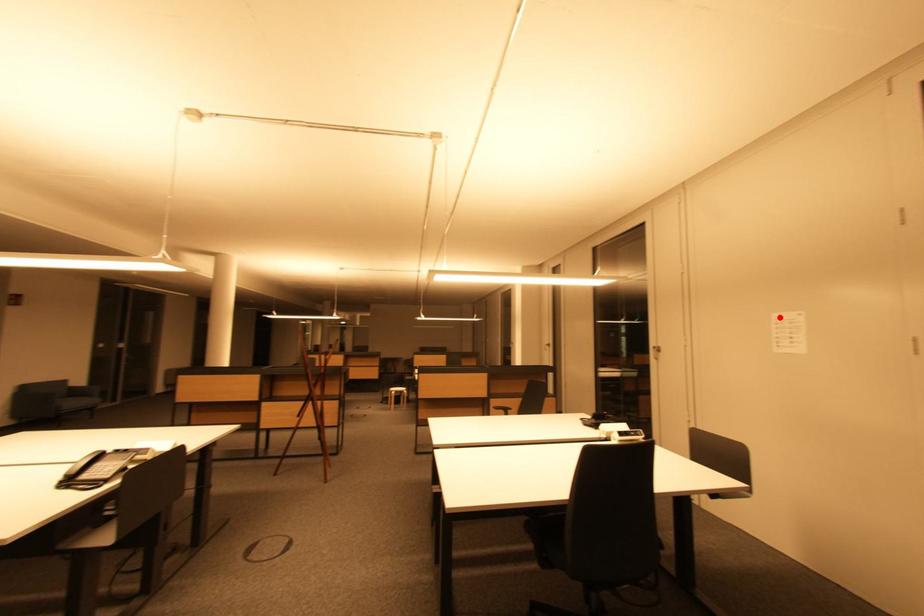
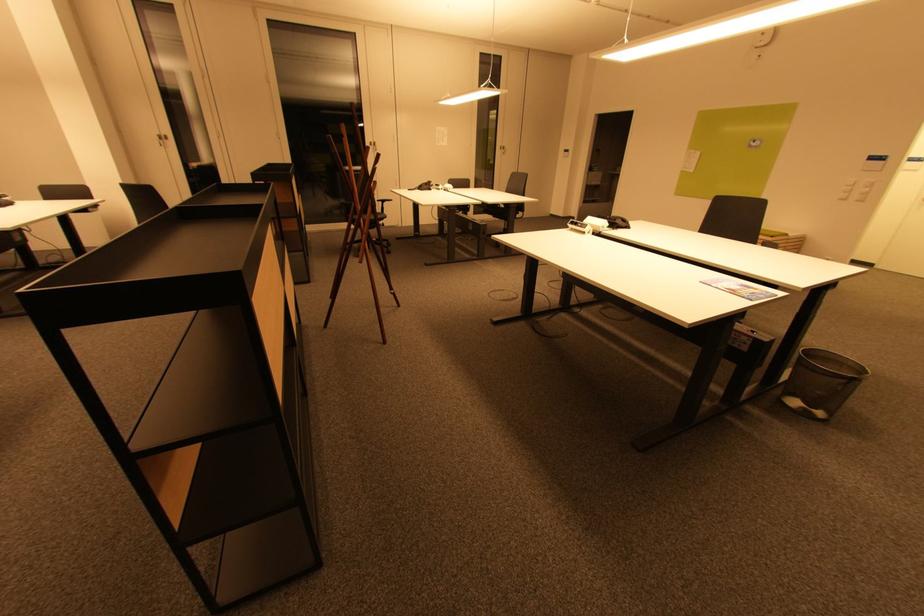
Question: I am providing you with two images of the same scene from different viewpoints. Given a red point in image1, look at the same physical point in image2. Is it:

Choices:
 (A) Closer to the viewpoint
 (B) Farther from the viewpoint

Answer: (A)